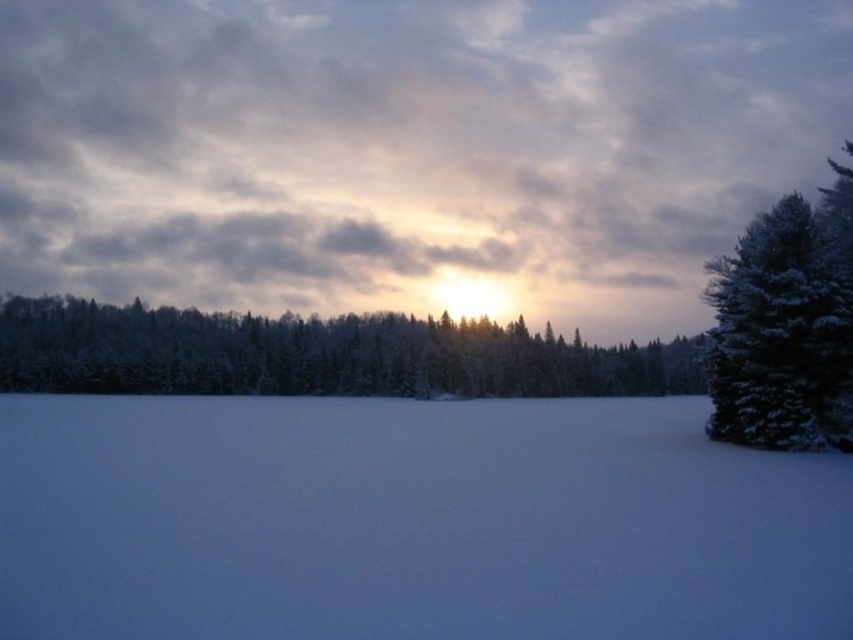
In the scene shown: You are standing at point (410, 522) in the winter landscape. What is the terrain like at your current location?

The terrain at point (410, 522) is white powdery snow at lower center.